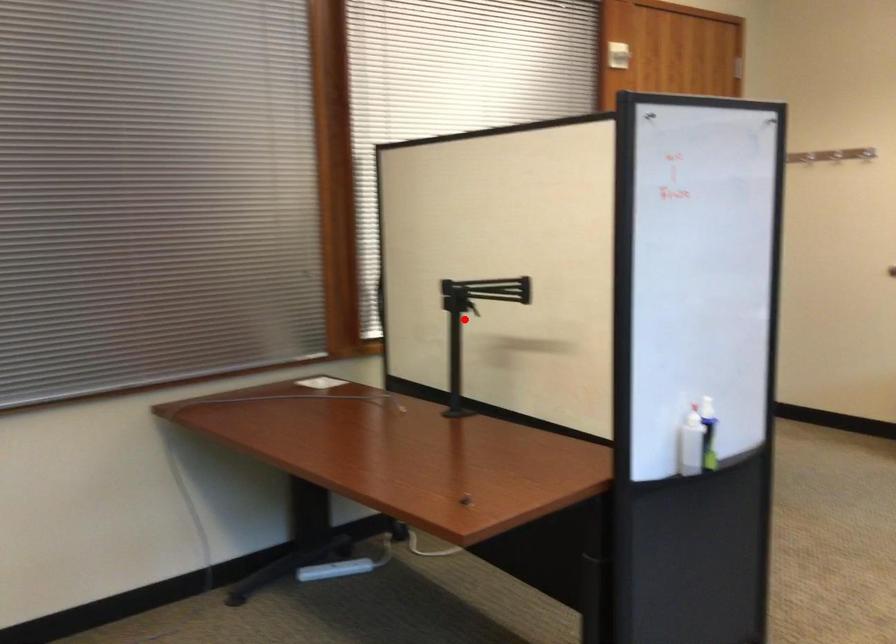
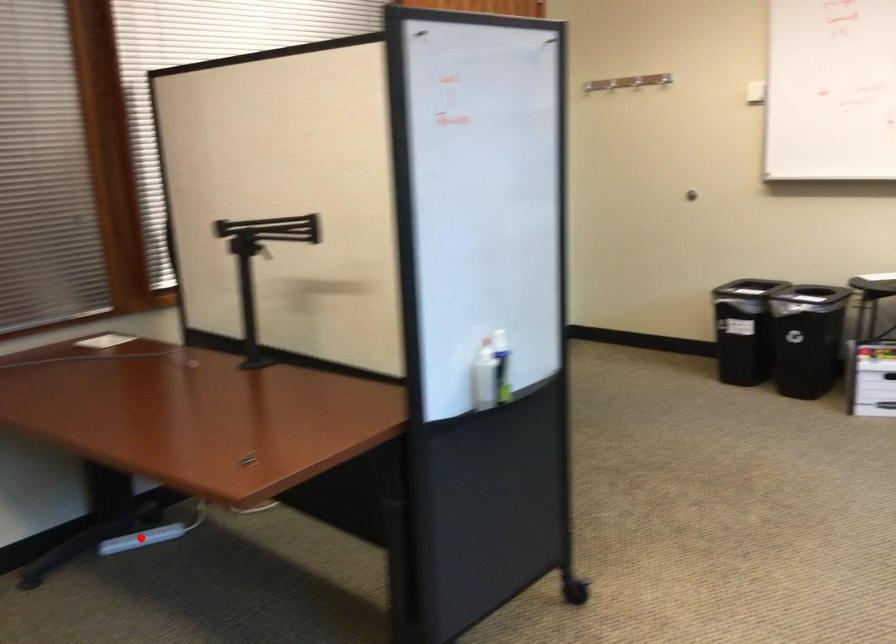
I am providing you with two images of the same scene from different viewpoints. A red point is marked on the first image and another point is marked on the second image. Is the red point in image1 aligned with the point shown in image2?

No